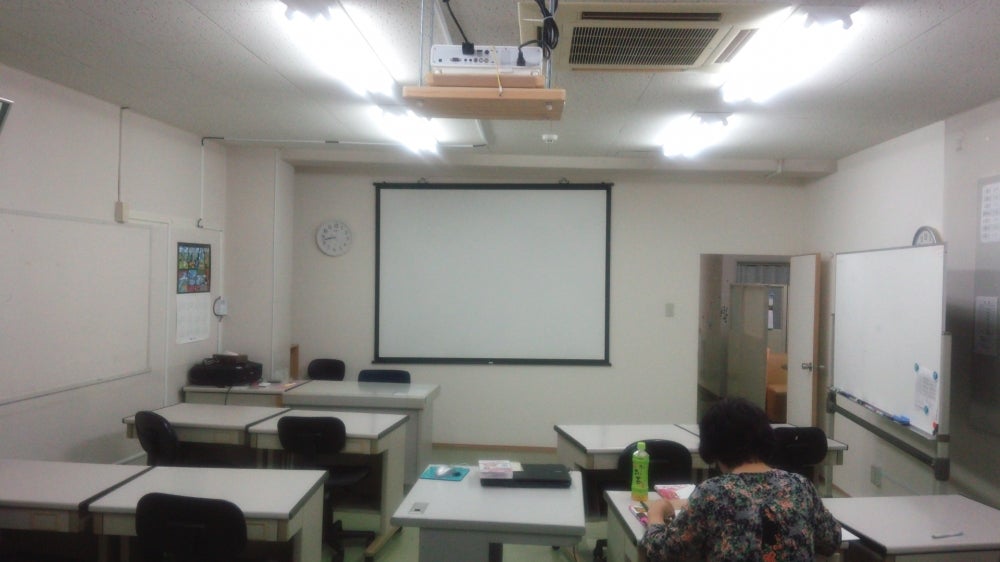
Find the location of a particular element. Image resolution: width=1000 pixels, height=562 pixels. projector is located at coordinates (496, 40), (462, 49), (441, 57), (465, 61), (502, 61).